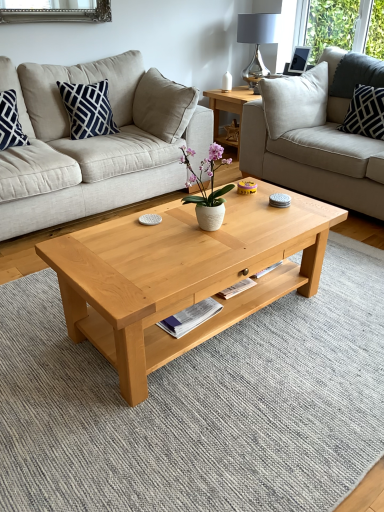
Find the location of `blank area beneath white ceramic vase at center (from a real-world perspective)`. blank area beneath white ceramic vase at center (from a real-world perspective) is located at coordinates (202, 233).